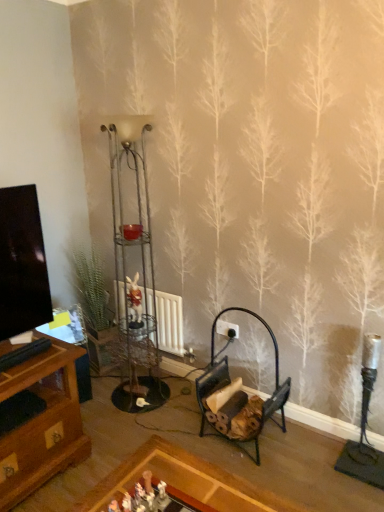
Question: From a real-world perspective, is white plastic toy at center, which appears as the first toy when viewed from the right, physically located above or below white glossy rabbit at center, the 1th toy viewed from the top?

Choices:
 (A) below
 (B) above

Answer: (A)

Question: Does point (167, 501) appear closer or farther from the camera than point (135, 313)?

Choices:
 (A) closer
 (B) farther

Answer: (A)

Question: Which object is the farthest from the black metal firewood rack at lower center?

Choices:
 (A) white matte radiator at center
 (B) white plastic toy at center, marked as the first toy in a bottom-to-top arrangement
 (C) white glossy rabbit at center, acting as the first toy starting from the back

Answer: (B)

Question: Which of these objects is positioned farthest from the white matte radiator at center?

Choices:
 (A) black metal firewood rack at lower center
 (B) white glossy rabbit at center, marked as the 2th toy in a front-to-back arrangement
 (C) white plastic toy at center, which is the 2th toy in left-to-right order

Answer: (C)